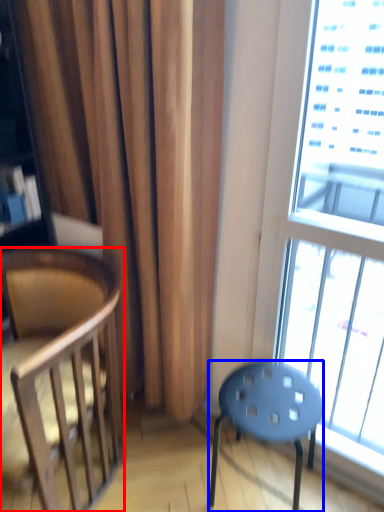
Question: Which point is further to the camera, chair (highlighted by a red box) or stool (highlighted by a blue box)?

Choices:
 (A) chair
 (B) stool

Answer: (B)